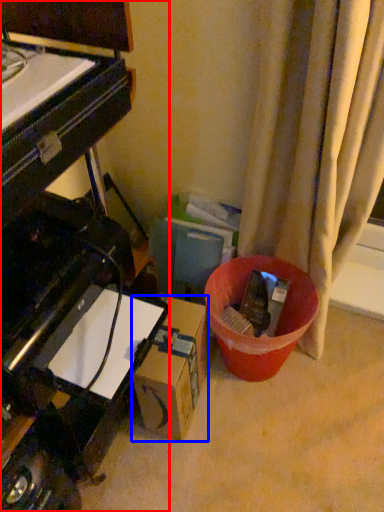
Question: Which point is further to the camera, piano (highlighted by a red box) or cardboard box (highlighted by a blue box)?

Choices:
 (A) piano
 (B) cardboard box

Answer: (B)